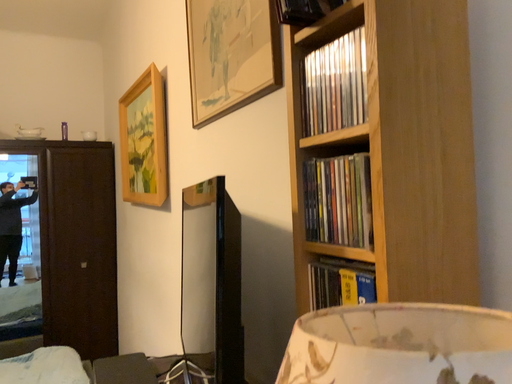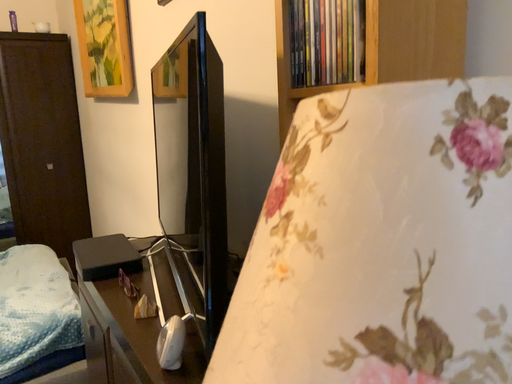
Question: Which way did the camera rotate in the video?

Choices:
 (A) rotated upward
 (B) rotated downward

Answer: (B)